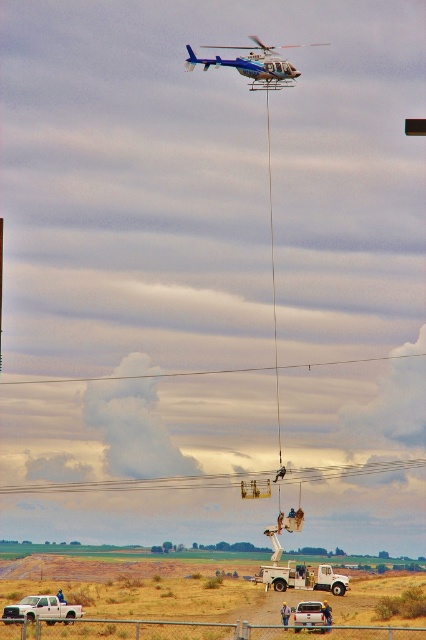
Can you confirm if blue metallic helicopter at upper center is positioned below white matte truck at lower center?

No.

Does blue metallic helicopter at upper center appear on the left side of white matte truck at lower center?

Indeed, blue metallic helicopter at upper center is positioned on the left side of white matte truck at lower center.

Does point (258, 72) lie in front of point (313, 620)?

No, it is behind (313, 620).

At what (x,y) coordinates should I click in order to perform the action: click on blue metallic helicopter at upper center. Please return your answer as a coordinate pair (x, y). Image resolution: width=426 pixels, height=640 pixels. Looking at the image, I should click on (253, 64).

Can you confirm if white matte truck at lower left is bigger than white matte truck at lower center?

Correct, white matte truck at lower left is larger in size than white matte truck at lower center.

What do you see at coordinates (42, 609) in the screenshot? The height and width of the screenshot is (640, 426). I see `white matte truck at lower left` at bounding box center [42, 609].

Locate an element on the screen. This screenshot has height=640, width=426. white matte truck at lower left is located at coordinates (42, 609).

Who is taller, blue metallic helicopter at upper center or white matte truck at lower left?

Standing taller between the two is blue metallic helicopter at upper center.

Which of these two, blue metallic helicopter at upper center or white matte truck at lower left, stands shorter?

white matte truck at lower left is shorter.

Does point (256, 42) come farther from viewer compared to point (65, 620)?

Yes, point (256, 42) is farther from viewer.

Where is `blue metallic helicopter at upper center`? blue metallic helicopter at upper center is located at coordinates (253, 64).